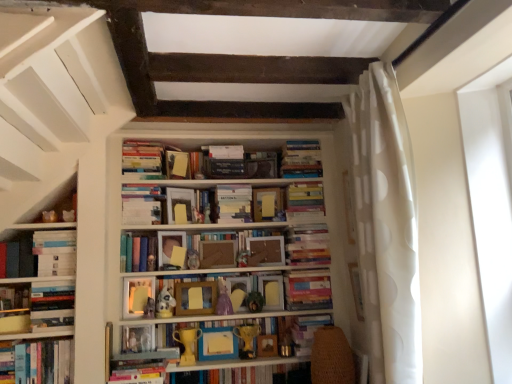
Question: Are hardcover book at center, the twelfth paperback book when ordered from bottom to top, and white matte bookshelf at center far apart?

Choices:
 (A) no
 (B) yes

Answer: (A)

Question: Can you confirm if hardcover book at center, which is the fourth paperback book in top-to-bottom order, is positioned to the left of white matte bookshelf at center?

Choices:
 (A) yes
 (B) no

Answer: (A)

Question: Could you tell me if hardcover book at center, the twelfth paperback book when ordered from bottom to top, is facing white matte bookshelf at center?

Choices:
 (A) no
 (B) yes

Answer: (B)

Question: Is hardcover book at center, the twelfth paperback book when ordered from bottom to top, shorter than white matte bookshelf at center?

Choices:
 (A) no
 (B) yes

Answer: (B)

Question: Is hardcover book at center, which is the fourth paperback book in top-to-bottom order, positioned with its back to white matte bookshelf at center?

Choices:
 (A) no
 (B) yes

Answer: (B)

Question: From a real-world perspective, is hardcover book at center, which is the fourth paperback book in top-to-bottom order, located beneath white matte bookshelf at center?

Choices:
 (A) yes
 (B) no

Answer: (B)

Question: Can you confirm if matte yellow paper at center, which is the 15th paperback book from bottom to top, is taller than wooden frame at center, which is counted as the seventh book, starting from the top?

Choices:
 (A) yes
 (B) no

Answer: (B)

Question: Is matte yellow paper at center, which is the first paperback book in top-to-bottom order, bigger than wooden frame at center, the 4th book in the bottom-to-top sequence?

Choices:
 (A) yes
 (B) no

Answer: (B)

Question: Could you tell me if matte yellow paper at center, which is the 15th paperback book from bottom to top, is turned towards wooden frame at center, the 4th book in the bottom-to-top sequence?

Choices:
 (A) no
 (B) yes

Answer: (A)

Question: Is matte yellow paper at center, which is the 15th paperback book from bottom to top, not within wooden frame at center, which is counted as the seventh book, starting from the top?

Choices:
 (A) yes
 (B) no

Answer: (A)

Question: Is matte yellow paper at center, which is the first paperback book in top-to-bottom order, further to the viewer compared to wooden frame at center, which is counted as the seventh book, starting from the top?

Choices:
 (A) no
 (B) yes

Answer: (B)

Question: Is wooden frame at center, the 4th book in the bottom-to-top sequence, at the back of matte yellow paper at center, which is the 15th paperback book from bottom to top?

Choices:
 (A) no
 (B) yes

Answer: (A)

Question: Can you confirm if hardcover books at center, the 9th book when ordered from bottom to top, is bigger than white matte bookshelf at center?

Choices:
 (A) yes
 (B) no

Answer: (B)